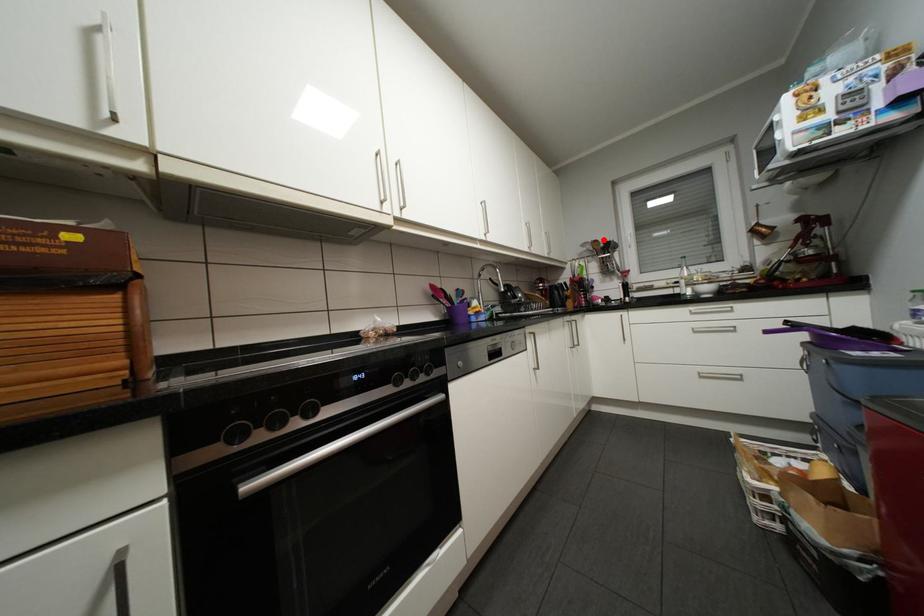
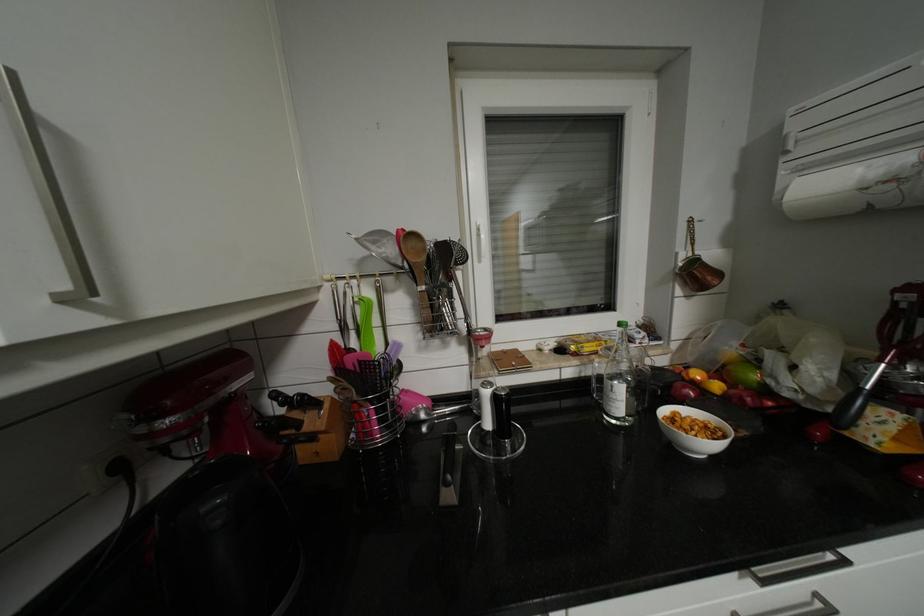
In the second image, find the point that corresponds to the highlighted location in the first image.

(421, 235)